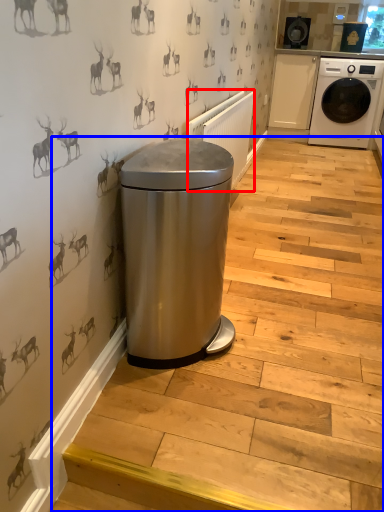
Question: Which object is further to the camera taking this photo, radiator (highlighted by a red box) or stairwell (highlighted by a blue box)?

Choices:
 (A) radiator
 (B) stairwell

Answer: (A)